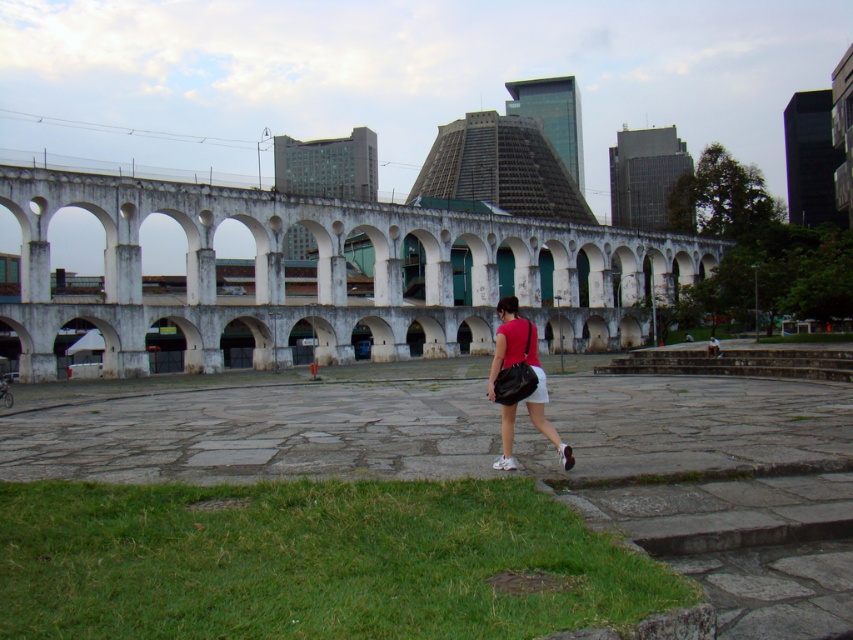
You are a photographer standing in the square and want to capture both the matte black bag at center and the white cotton shorts at lower center in the same frame. Which object should you focus on first to ensure both are in the shot?

You should focus on the matte black bag at center first since it is wider than the white cotton shorts at lower center, ensuring both will fit within the frame.

You are standing on the paved square looking towards the white arched structure. You see the green grass at lower left and the white cotton shorts at lower center. Which object is closer to your left side?

The green grass at lower left is closer to your left side as it is positioned to the left of the white cotton shorts at lower center.

You are a photographer planning to capture a contrast between nature and modernity in the scene. You have the green grass at lower left and the white cotton shorts at lower center in your viewfinder. Based on their widths, which area should you focus on to emphasize the natural element more prominently?

The green grass at lower left might be wider than the white cotton shorts at lower center, so focusing on the green grass at lower left would emphasize the natural element more prominently due to its potentially larger width.